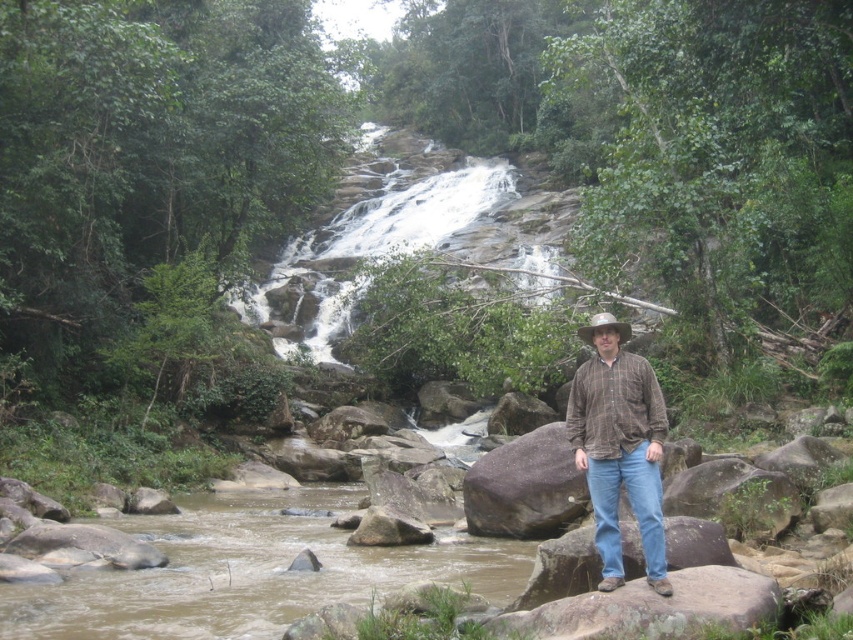
You are a photographer trying to capture the man in the scene. You notice the brown plaid shirt at center and the brown woven cowboy hat at center. Which object should you focus on first if you want to capture the shirt before the hat?

The brown plaid shirt at center is positioned on the left side of brown woven cowboy hat at center, so you should focus on the brown plaid shirt at center first to capture it before the hat.

You are a photographer trying to capture the man in the scene. You need to ensure that both the brown plaid shirt at center and the brown woven cowboy hat at center are clearly visible in the photo. Given their sizes, which object should you focus on to ensure both are in frame without cropping?

The brown plaid shirt at center is narrower than the brown woven cowboy hat at center. To ensure both are in frame without cropping, focus on the wider brown woven cowboy hat at center as it requires more space.

You are a hiker trying to navigate between two points marked in the image. The first point is at coordinates point (633, 448) and the second is at point (616, 330). Which point is closer to you as you stand at the starting position?

Point (633, 448) is closer to the viewer than point (616, 330), so the first point is closer.